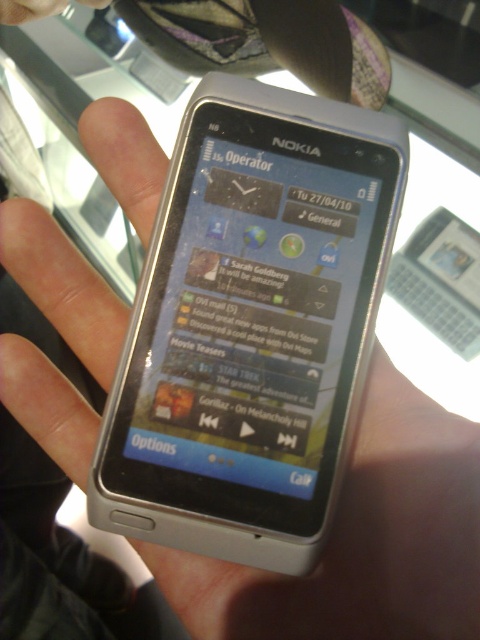
Between silver metallic phone at center and black matte text at upper center, which one appears on the right side from the viewer's perspective?

From the viewer's perspective, silver metallic phone at center appears more on the right side.

Which is in front, point (377, 624) or point (211, 147)?

Point (377, 624) is in front.

Locate an element on the screen. The height and width of the screenshot is (640, 480). silver metallic phone at center is located at coordinates (361, 540).

Where is `silver metallic phone at center`? silver metallic phone at center is located at coordinates (361, 540).